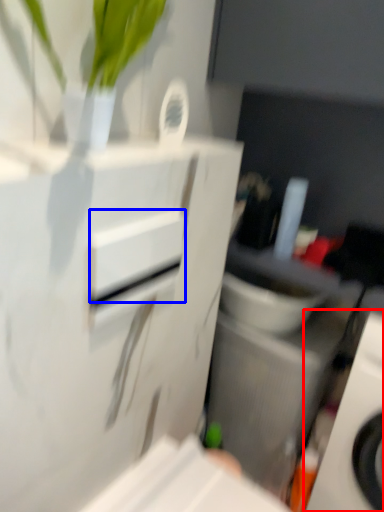
Question: Which object is closer to the camera taking this photo, home appliance (highlighted by a red box) or drawer (highlighted by a blue box)?

Choices:
 (A) home appliance
 (B) drawer

Answer: (B)